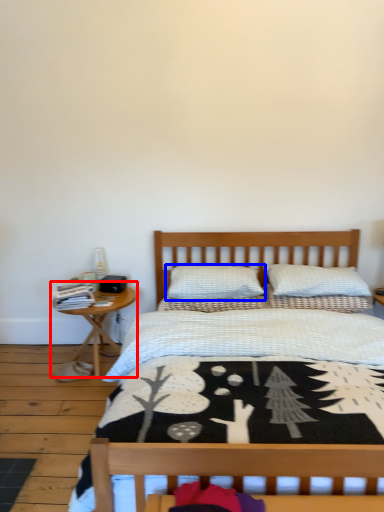
Question: Which object appears closest to the camera in this image, nightstand (highlighted by a red box) or pillow (highlighted by a blue box)?

Choices:
 (A) nightstand
 (B) pillow

Answer: (A)